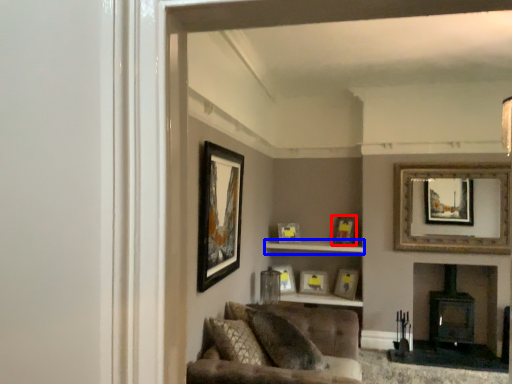
Question: Which point is further to the camera, picture frame (highlighted by a red box) or cabinet (highlighted by a blue box)?

Choices:
 (A) picture frame
 (B) cabinet

Answer: (A)